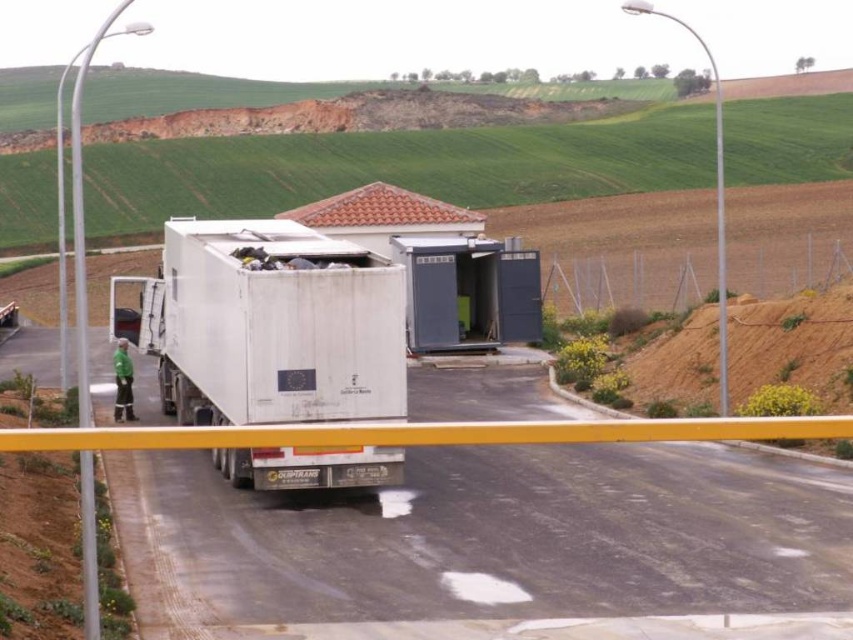
Locate an element on the screen. white matte truck at center is located at coordinates (492, 538).

Who is more forward, (755, 493) or (264, 257)?

Point (755, 493) is in front.

Who is more forward, (189, 614) or (166, 358)?

Point (189, 614) is in front.

Where is `white matte truck at center`? This screenshot has width=853, height=640. white matte truck at center is located at coordinates (492, 538).